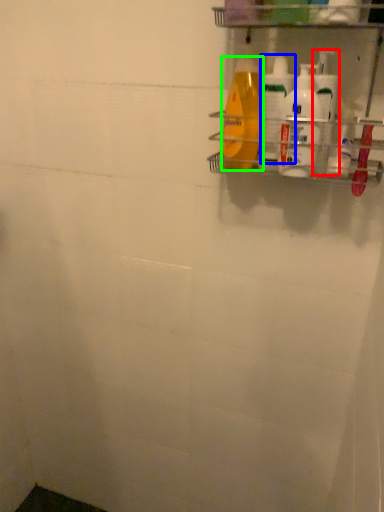
Question: Which object is the farthest from cleaning product (highlighted by a red box)? Choose among these: cleaning product (highlighted by a blue box) or cleaning product (highlighted by a green box).

Choices:
 (A) cleaning product
 (B) cleaning product

Answer: (B)